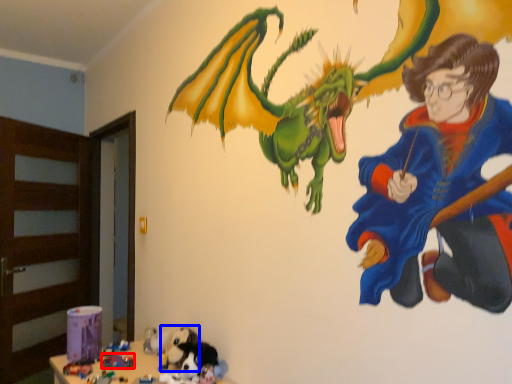
Question: Which of the following is the farthest to the observer, toy (highlighted by a red box) or animal (highlighted by a blue box)?

Choices:
 (A) toy
 (B) animal

Answer: (A)